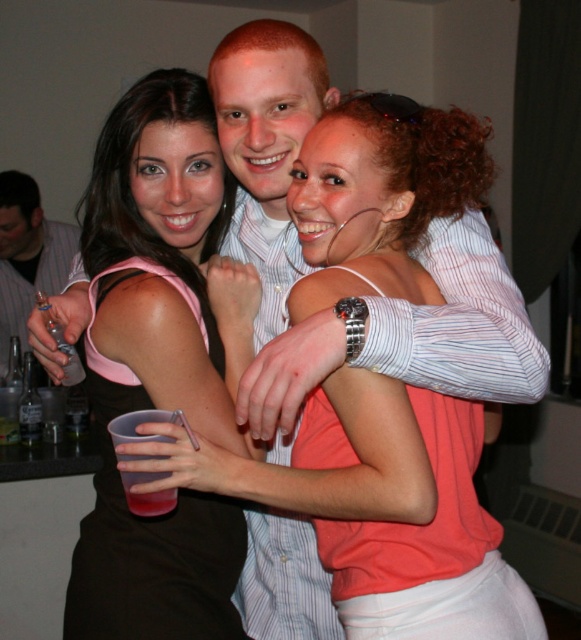
Does black fabric dress at center have a greater height compared to brushed metal can at left?

In fact, black fabric dress at center may be shorter than brushed metal can at left.

Image resolution: width=581 pixels, height=640 pixels. Find the location of `black fabric dress at center`. black fabric dress at center is located at coordinates [148, 554].

Find the location of a particular element. black fabric dress at center is located at coordinates (148, 554).